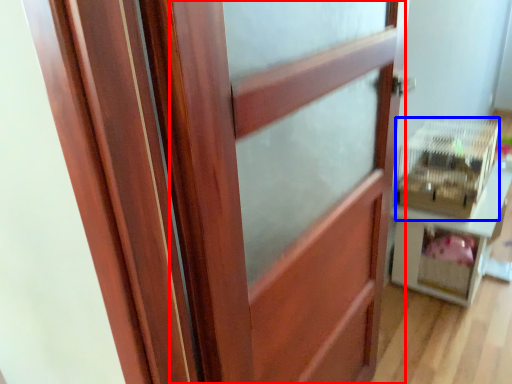
Question: Which object appears farthest to the camera in this image, barn door (highlighted by a red box) or crate (highlighted by a blue box)?

Choices:
 (A) barn door
 (B) crate

Answer: (B)